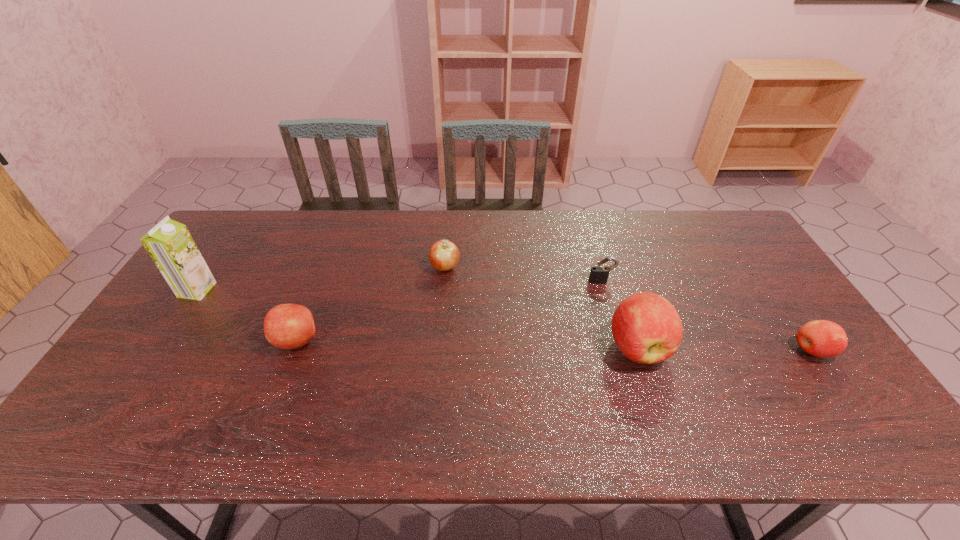
Identify the location of vacant space that satisfies the following two spatial constraints: 1. with the keyhole on the front of the rightmost apple; 2. on the right side of the padlock. (621, 350).

Where is `vacant space that satisfies the following two spatial constraints: 1. on the front side of the rightmost apple; 2. on the right side of the tallest object`? vacant space that satisfies the following two spatial constraints: 1. on the front side of the rightmost apple; 2. on the right side of the tallest object is located at coordinates (156, 350).

This screenshot has width=960, height=540. What are the coordinates of `free location that satisfies the following two spatial constraints: 1. with the keyhole on the front of the padlock; 2. on the right side of the rightmost apple` in the screenshot? It's located at pyautogui.click(x=621, y=350).

At what (x,y) coordinates should I click in order to perform the action: click on vacant point that satisfies the following two spatial constraints: 1. on the front side of the rightmost apple; 2. on the right side of the farthest apple. Please return your answer as a coordinate pair (x, y). The height and width of the screenshot is (540, 960). Looking at the image, I should click on (438, 350).